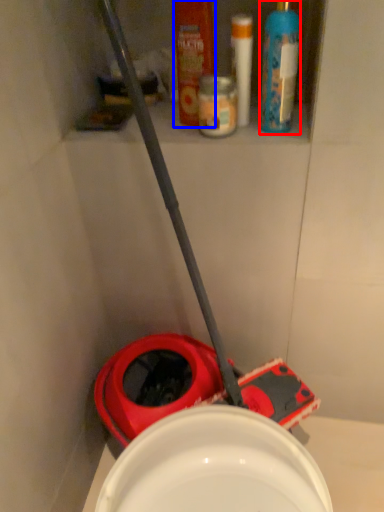
Question: Which object is further to the camera taking this photo, cleaning product (highlighted by a red box) or mouthwash (highlighted by a blue box)?

Choices:
 (A) cleaning product
 (B) mouthwash

Answer: (B)